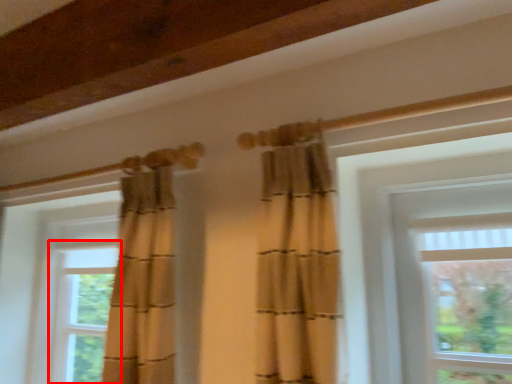
Question: From the image's perspective, considering the relative positions of window (annotated by the red box) and window in the image provided, where is window (annotated by the red box) located with respect to the staircase?

Choices:
 (A) above
 (B) below

Answer: (B)